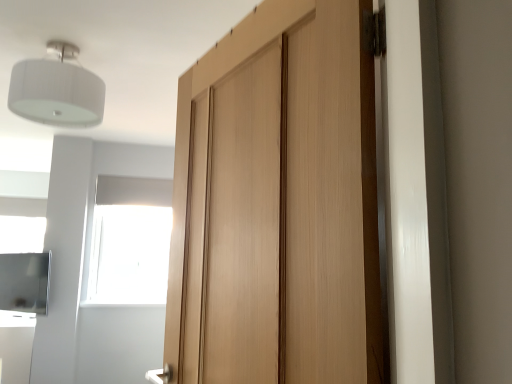
Question: From the image's perspective, does light wood door at center appear lower than white fabric lampshade at upper left?

Choices:
 (A) no
 (B) yes

Answer: (B)

Question: Is light wood door at center not inside white fabric lampshade at upper left?

Choices:
 (A) yes
 (B) no

Answer: (A)

Question: Is light wood door at center to the right of white fabric lampshade at upper left from the viewer's perspective?

Choices:
 (A) no
 (B) yes

Answer: (B)

Question: Does light wood door at center lie in front of white fabric lampshade at upper left?

Choices:
 (A) no
 (B) yes

Answer: (B)

Question: Is light wood door at center thinner than white fabric lampshade at upper left?

Choices:
 (A) yes
 (B) no

Answer: (A)

Question: Can white fabric lampshade at upper left be found inside light wood door at center?

Choices:
 (A) yes
 (B) no

Answer: (B)

Question: From a real-world perspective, is light wood door at center on top of satin silver cabinet at lower left?

Choices:
 (A) no
 (B) yes

Answer: (B)

Question: Considering the relative sizes of light wood door at center and satin silver cabinet at lower left in the image provided, is light wood door at center shorter than satin silver cabinet at lower left?

Choices:
 (A) no
 (B) yes

Answer: (A)

Question: Does light wood door at center touch satin silver cabinet at lower left?

Choices:
 (A) yes
 (B) no

Answer: (B)

Question: Is light wood door at center bigger than satin silver cabinet at lower left?

Choices:
 (A) yes
 (B) no

Answer: (A)

Question: Considering the relative positions of light wood door at center and satin silver cabinet at lower left in the image provided, is light wood door at center to the left of satin silver cabinet at lower left from the viewer's perspective?

Choices:
 (A) no
 (B) yes

Answer: (A)

Question: From the image's perspective, is light wood door at center under satin silver cabinet at lower left?

Choices:
 (A) no
 (B) yes

Answer: (A)

Question: Can you confirm if satin silver cabinet at lower left is smaller than light wood door at center?

Choices:
 (A) yes
 (B) no

Answer: (A)